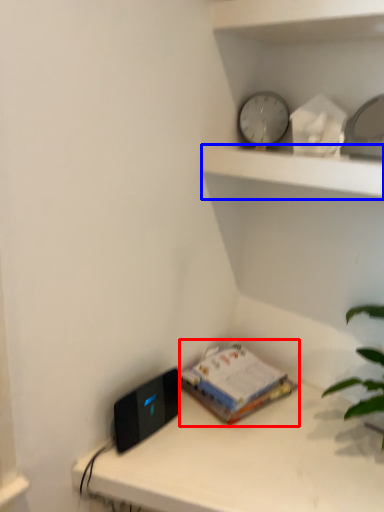
Question: Which object is further to the camera taking this photo, paperback book (highlighted by a red box) or shelf (highlighted by a blue box)?

Choices:
 (A) paperback book
 (B) shelf

Answer: (A)